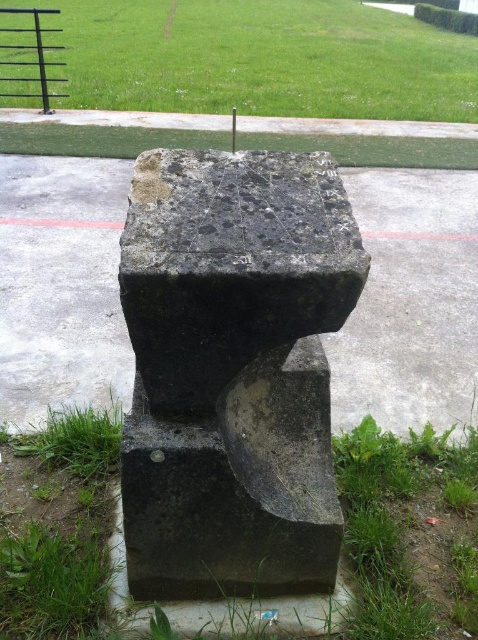
Question: Is green grass at lower left to the left of green grass at upper center from the viewer's perspective?

Choices:
 (A) no
 (B) yes

Answer: (A)

Question: Estimate the real-world distances between objects in this image. Which object is farther from the green grass at upper center?

Choices:
 (A) green grass at lower left
 (B) dark gray concrete at center

Answer: (A)

Question: Can you confirm if green grass at lower left is positioned to the left of green grass at upper center?

Choices:
 (A) yes
 (B) no

Answer: (B)

Question: Among these points, which one is nearest to the camera?

Choices:
 (A) (308, 566)
 (B) (424, 70)
 (C) (96, 317)

Answer: (A)

Question: Can you confirm if dark gray concrete at center is bigger than green grass at lower left?

Choices:
 (A) yes
 (B) no

Answer: (A)

Question: Among these objects, which one is nearest to the camera?

Choices:
 (A) dark gray concrete at center
 (B) green grass at upper center
 (C) green grass at lower left

Answer: (C)